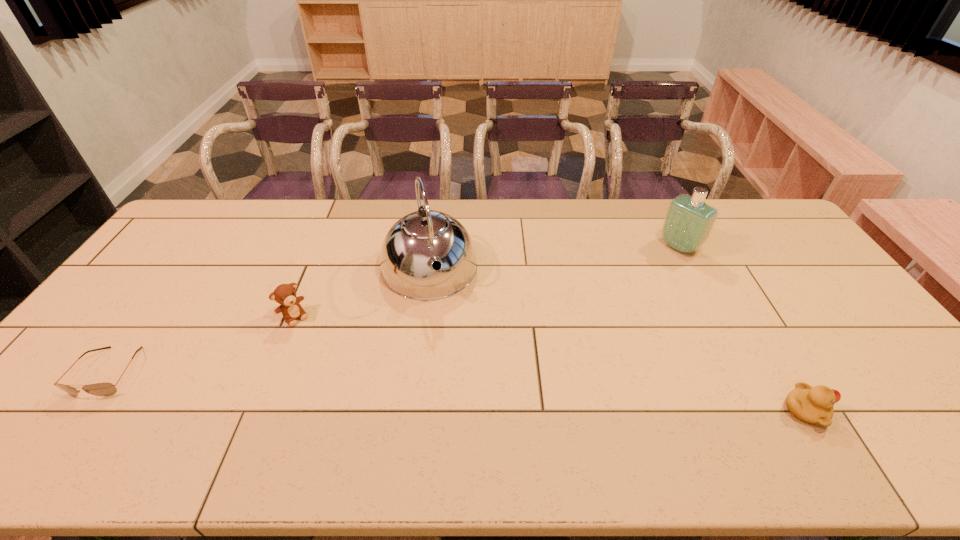
Where is `the shortest object`? This screenshot has height=540, width=960. the shortest object is located at coordinates (99, 389).

Identify the location of sunglasses. (99, 389).

At what (x,y) coordinates should I click in order to perform the action: click on duckling. Please return your answer as a coordinate pair (x, y). Looking at the image, I should click on (814, 405).

Where is `kettle`? kettle is located at coordinates (415, 242).

In order to click on the third object from right to left in this screenshot , I will do `click(415, 242)`.

Where is `the fourth shortest object`? The width and height of the screenshot is (960, 540). the fourth shortest object is located at coordinates (689, 221).

The height and width of the screenshot is (540, 960). In order to click on the second object from left to right in this screenshot , I will do `click(284, 294)`.

I want to click on teddy bear, so click(x=284, y=294).

Find the location of a particular element. free space located at the beak of the second shortest object is located at coordinates (900, 410).

Where is `vacant area situated from the spout of the tallest object`? This screenshot has width=960, height=540. vacant area situated from the spout of the tallest object is located at coordinates (451, 353).